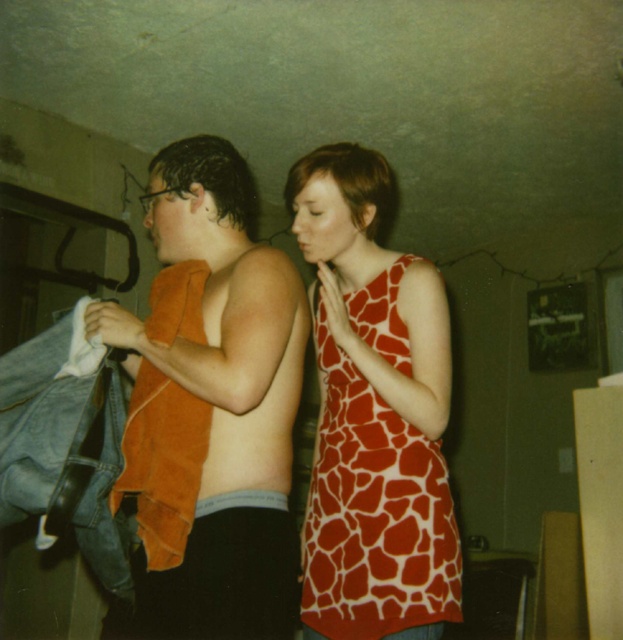
In the scene described, there are two people and an orange towel at center. Which object is located at the coordinates point (221, 404)?

The orange towel at center is located at point (221, 404).

You are standing in the room and want to pick up an object located at point (244, 636) and another at point (406, 472). Which point is closer to you?

Point (244, 636) is closer to the camera than point (406, 472), so you can reach it first.

You are standing in the room and want to reach the point marked as point (221, 168). If you can move forward 4 feet, will you be able to reach it?

The distance between you and point (221, 168) is 4.61 feet. Since you can only move forward 4 feet, you will not be able to reach it.